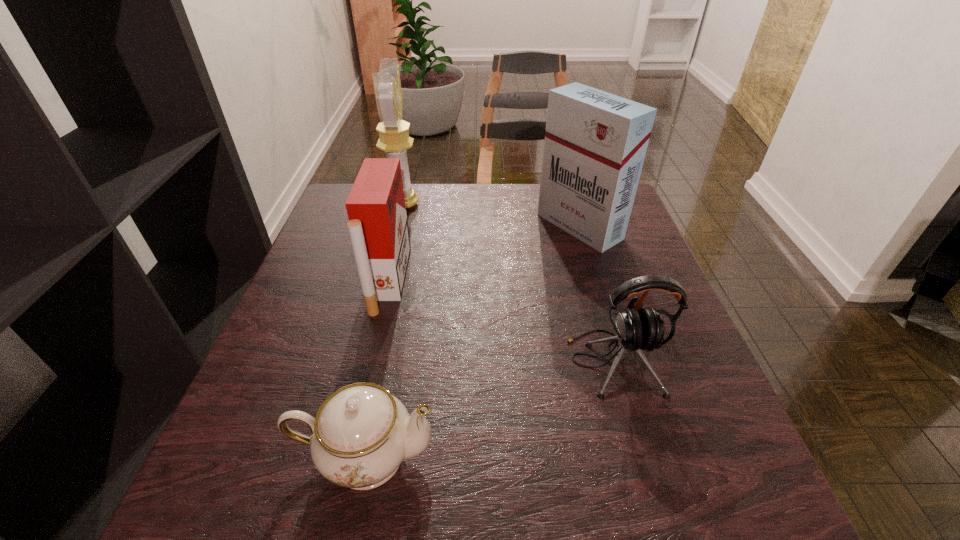
The width and height of the screenshot is (960, 540). I want to click on object present at the far right corner, so click(x=595, y=144).

This screenshot has height=540, width=960. In order to click on free space at the far edge of the desktop in this screenshot , I will do `click(484, 202)`.

Locate an element on the screen. Image resolution: width=960 pixels, height=540 pixels. free space at the near edge of the desktop is located at coordinates (455, 506).

I want to click on vacant space at the left edge of the desktop, so click(x=303, y=273).

Locate an element on the screen. free space at the right edge is located at coordinates (618, 284).

The width and height of the screenshot is (960, 540). I want to click on vacant space at the far left corner, so click(343, 224).

At what (x,y) coordinates should I click in order to perform the action: click on vacant space at the near left corner. Please return your answer as a coordinate pair (x, y). Looking at the image, I should click on (210, 507).

Locate an element on the screen. This screenshot has width=960, height=540. free space between the fourth farthest object and the chinaware is located at coordinates (490, 409).

At what (x,y) coordinates should I click in order to perform the action: click on empty space that is in between the chinaware and the left cigarette case. Please return your answer as a coordinate pair (x, y). This screenshot has height=540, width=960. Looking at the image, I should click on (377, 368).

This screenshot has width=960, height=540. I want to click on free space that is in between the earphone and the award, so point(509,283).